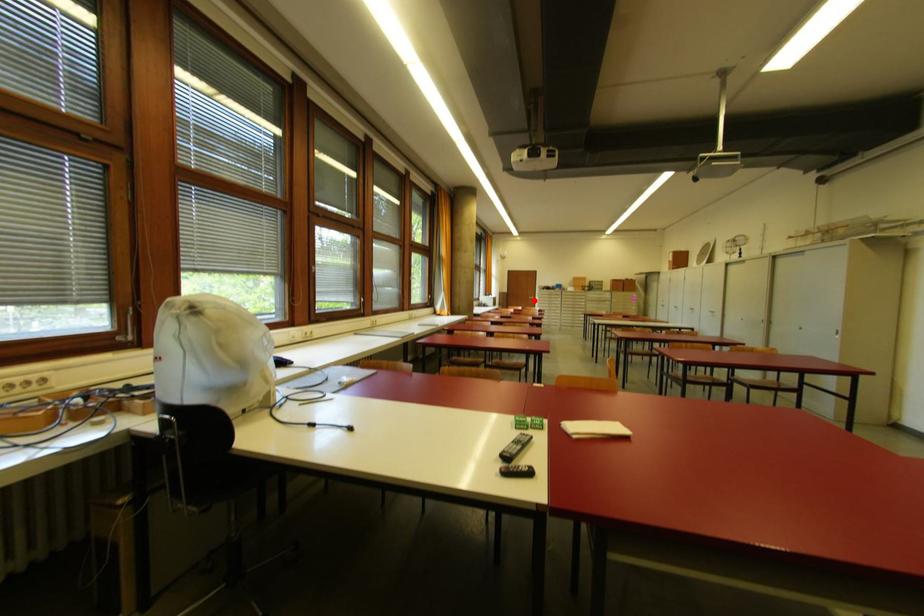
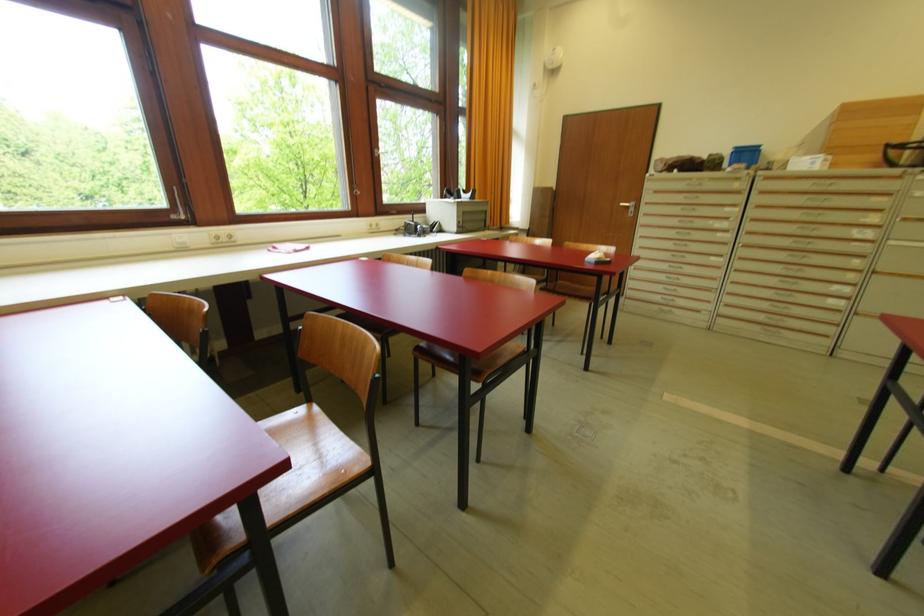
Where in the second image is the point corresponding to the highlighted location from the first image?

(629, 209)